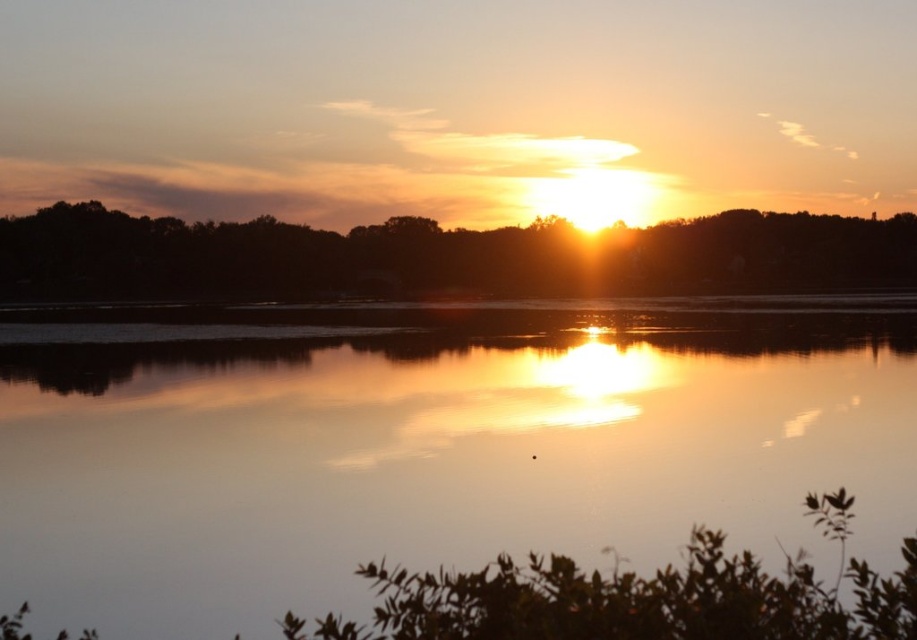
Does glossy reflective water at center lie behind silhouette tree at upper center?

That is False.

Is glossy reflective water at center below silhouette tree at upper center?

Yes, glossy reflective water at center is below silhouette tree at upper center.

Image resolution: width=917 pixels, height=640 pixels. What are the coordinates of `glossy reflective water at center` in the screenshot? It's located at (431, 445).